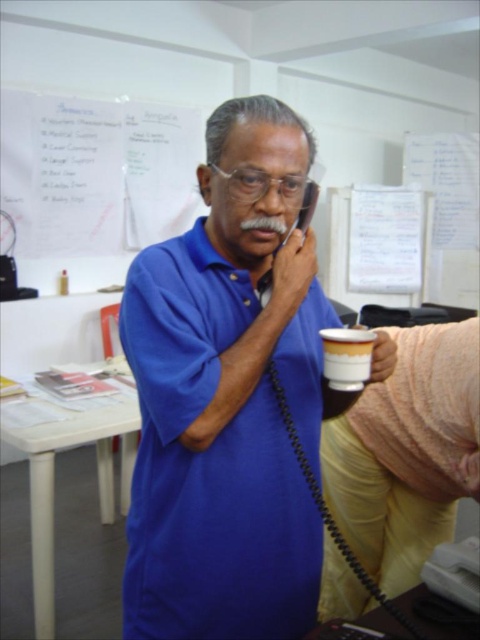
Does point (200, 470) come farther from viewer compared to point (365, 369)?

That is False.

Which is above, blue matte shirt at center or white matte cup at center?

Positioned higher is white matte cup at center.

Identify the location of blue matte shirt at center. (228, 396).